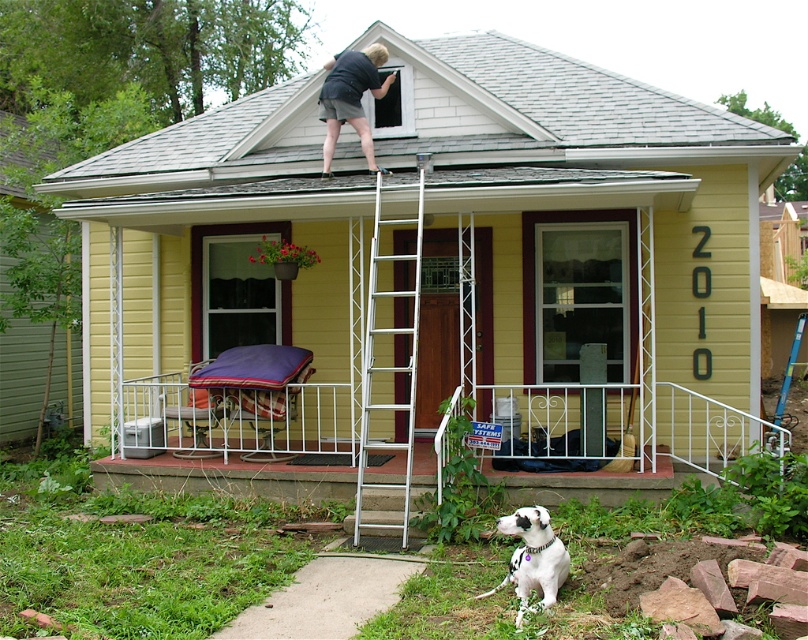
You are a delivery person trying to deliver a package to the house. The ladder is in the way of the front door. Can you walk between the white metallic ladder at upper center and the dark blue shirt at upper center to reach the door?

The white metallic ladder at upper center and the dark blue shirt at upper center are 6.50 feet apart, so yes, you can walk between them to reach the door since the space is wide enough for a person.

Consider the image. You are a delivery person trying to find the house number 2010. You see a point marked at coordinates (638, 436). Based on the scene description, what object is located at that point?

The point at coordinates (638, 436) indicates the white metal railing at lower center.

You are standing in front of the house and want to locate the white metal railing at lower center. What are the coordinates where you should look?

The white metal railing at lower center can be found at coordinates point [638,436].